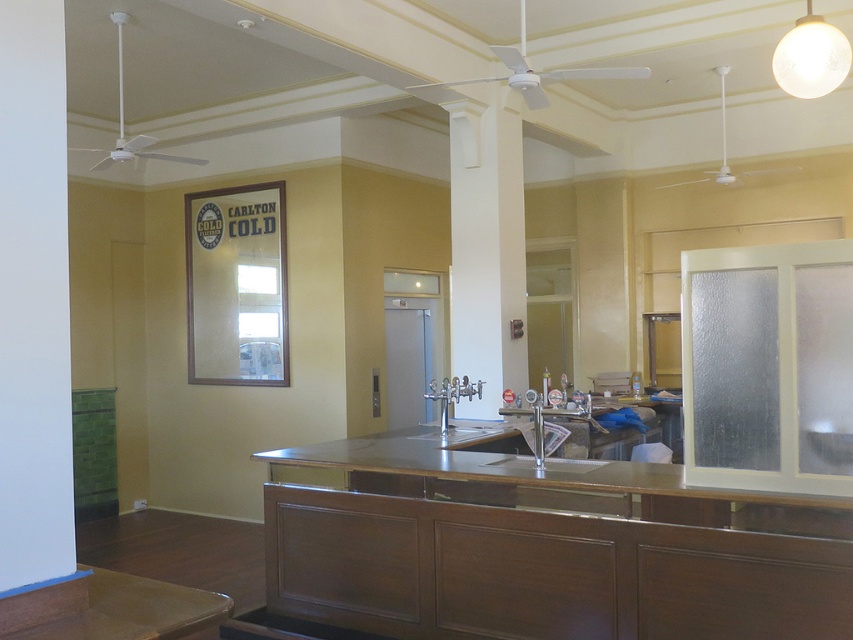
Which is behind, point (479, 557) or point (436, 397)?

Positioned behind is point (436, 397).

Is stainless steel counter at center shorter than silver metallic faucet at center?

In fact, stainless steel counter at center may be taller than silver metallic faucet at center.

Between point (677, 506) and point (432, 390), which one is positioned behind?

Positioned behind is point (432, 390).

The image size is (853, 640). In order to click on stainless steel counter at center in this screenshot , I will do `click(543, 547)`.

Who is more forward, (318, 595) or (541, 451)?

Point (541, 451)

From the picture: Measure the distance between stainless steel counter at center and camera.

2.95 meters

Does point (548, 500) come farther from viewer compared to point (535, 449)?

No, (548, 500) is in front of (535, 449).

The width and height of the screenshot is (853, 640). What are the coordinates of `stainless steel counter at center` in the screenshot? It's located at (543, 547).

Is silver metallic faucet at center below satin nickel faucet at center?

No.

Does silver metallic faucet at center have a larger size compared to satin nickel faucet at center?

Correct, silver metallic faucet at center is larger in size than satin nickel faucet at center.

Who is more forward, (x=456, y=380) or (x=543, y=454)?

Point (x=543, y=454) is more forward.

At what (x,y) coordinates should I click in order to perform the action: click on silver metallic faucet at center. Please return your answer as a coordinate pair (x, y). This screenshot has height=640, width=853. Looking at the image, I should click on (451, 396).